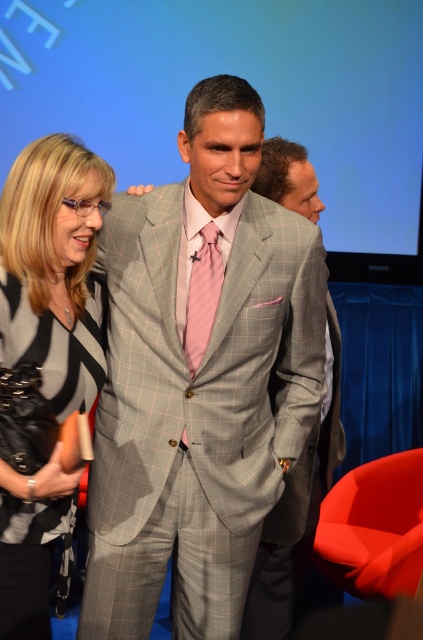
Question: Which point appears farthest from the camera in this image?

Choices:
 (A) click(84, 168)
 (B) click(206, 266)

Answer: (B)

Question: From the image, what is the correct spatial relationship of light gray checkered suit at center in relation to gray checkered suit at center?

Choices:
 (A) left
 (B) right

Answer: (A)

Question: Among these objects, which one is farthest from the camera?

Choices:
 (A) black textured blazer at left
 (B) gray checkered suit at center
 (C) pink satin tie at center
 (D) light gray checkered suit at center

Answer: (B)

Question: Can you confirm if light gray checkered suit at center is positioned above black textured blazer at left?

Choices:
 (A) yes
 (B) no

Answer: (A)

Question: Where is black textured blazer at left located in relation to gray checkered suit at center in the image?

Choices:
 (A) below
 (B) above

Answer: (B)

Question: Which point is farther to the camera?

Choices:
 (A) light gray checkered suit at center
 (B) pink satin tie at center
 (C) black textured blazer at left
 (D) gray checkered suit at center

Answer: (D)